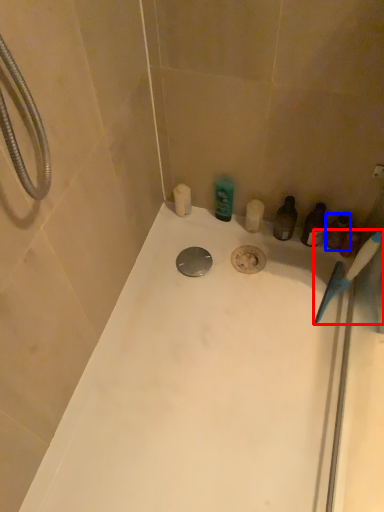
Question: Which object appears closest to the camera in this image, toothbrush (highlighted by a red box) or toiletry (highlighted by a blue box)?

Choices:
 (A) toothbrush
 (B) toiletry

Answer: (A)